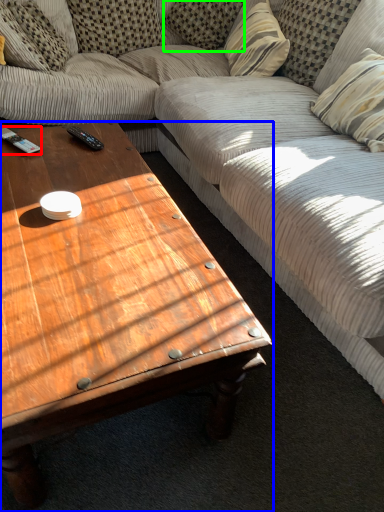
Question: Estimate the real-world distances between objects in this image. Which object is closer to remote control (highlighted by a red box), coffee table (highlighted by a blue box) or pillow (highlighted by a green box)?

Choices:
 (A) coffee table
 (B) pillow

Answer: (A)